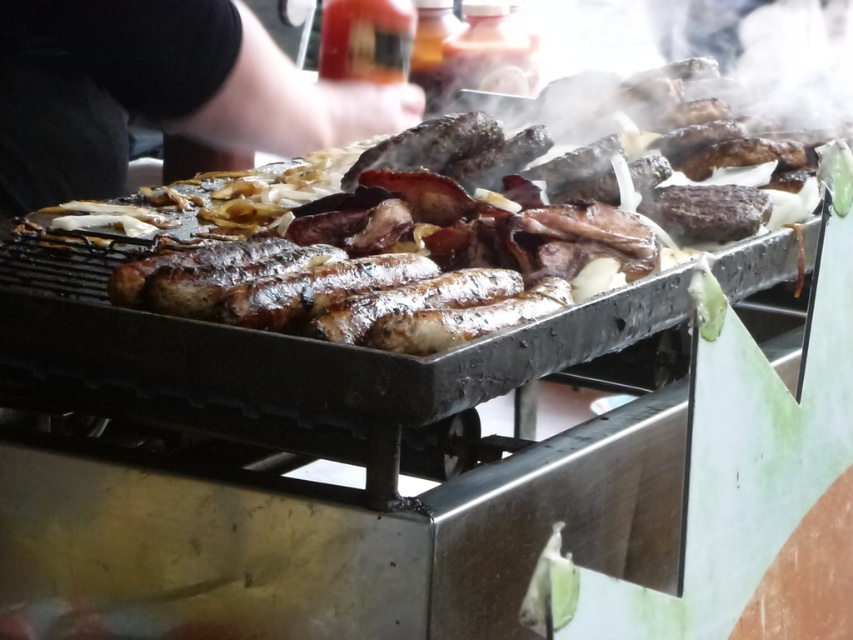
Does shiny brown meat at center have a larger size compared to black fabric arm at upper left?

Correct, shiny brown meat at center is larger in size than black fabric arm at upper left.

Looking at this image, is shiny brown meat at center to the left of black fabric arm at upper left from the viewer's perspective?

No, shiny brown meat at center is not to the left of black fabric arm at upper left.

Which is behind, point (605, 216) or point (242, 132)?

The point (242, 132) is behind.

Identify the location of shiny brown meat at center. (399, 244).